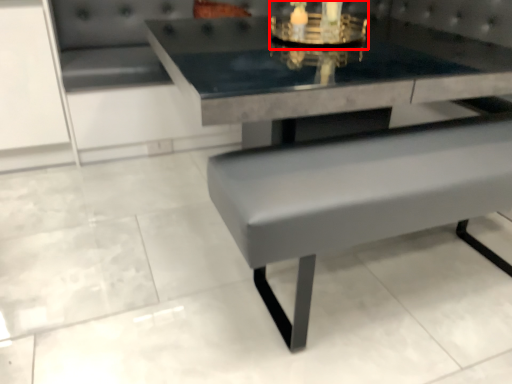
Question: Considering the relative positions of candle holder (annotated by the red box) and picnic table in the image provided, where is candle holder (annotated by the red box) located with respect to the staircase?

Choices:
 (A) left
 (B) right

Answer: (A)